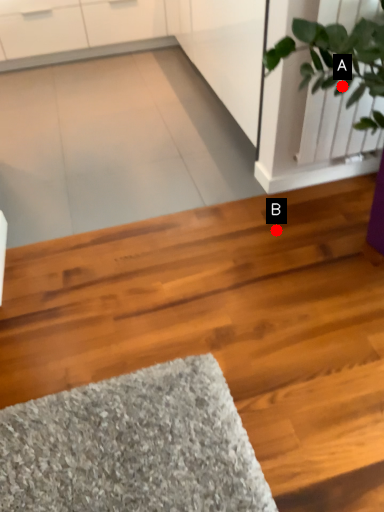
Question: Two points are circled on the image, labeled by A and B beside each circle. Which of the following is the farthest from the observer?

Choices:
 (A) A is further
 (B) B is further

Answer: (B)